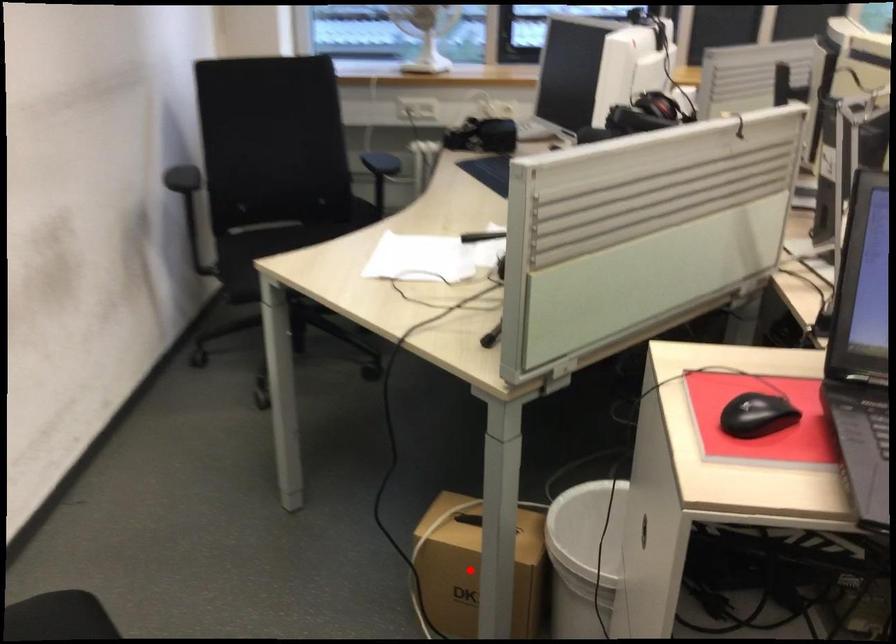
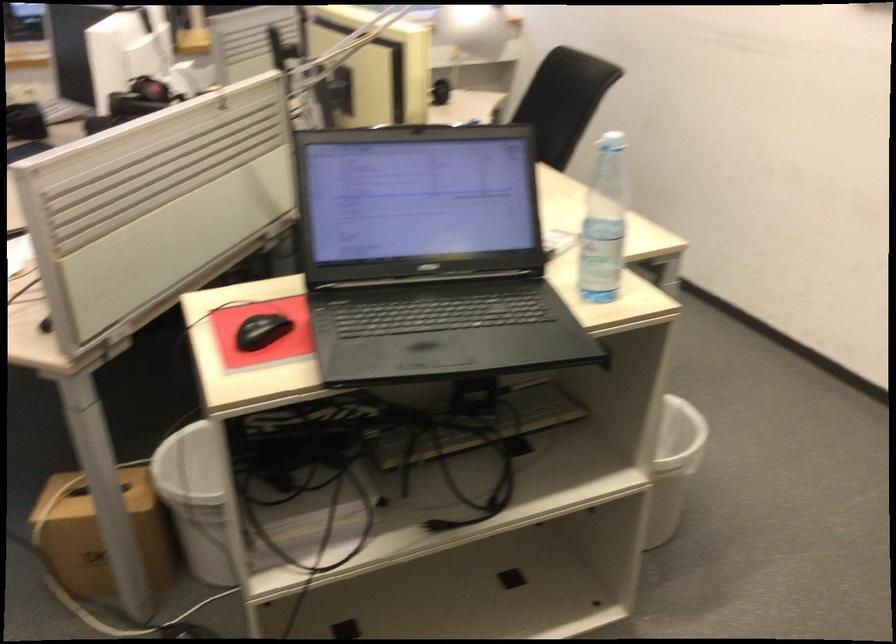
Where in the second image is the point corresponding to the highlighted location from the first image?

(100, 534)